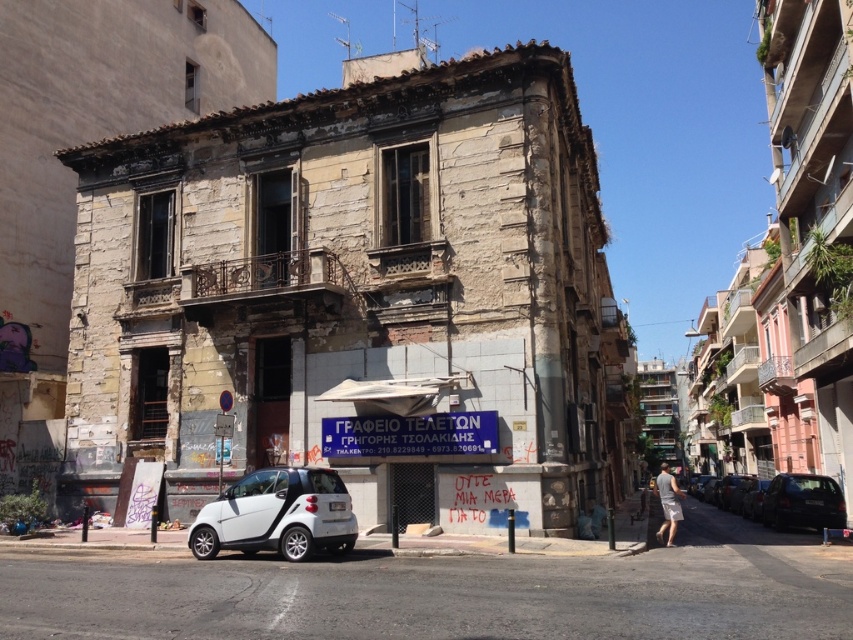
Which of these two, white matte car at center or dark gray metallic car at right, stands shorter?

white matte car at center is shorter.

Between point (308, 547) and point (815, 513), which one is positioned in front?

Point (308, 547) is in front.

The image size is (853, 640). I want to click on white matte car at center, so click(x=277, y=515).